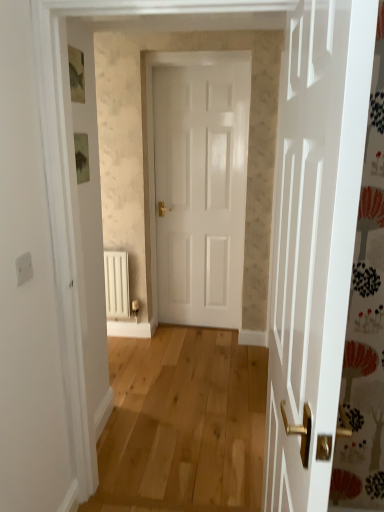
Question: Is the depth of white glossy door at center less than that of white matte radiator at lower left?

Choices:
 (A) no
 (B) yes

Answer: (B)

Question: Is white glossy door at center bigger than white matte radiator at lower left?

Choices:
 (A) yes
 (B) no

Answer: (A)

Question: Is white glossy door at center at the right side of white matte radiator at lower left?

Choices:
 (A) yes
 (B) no

Answer: (A)

Question: From the image's perspective, is white glossy door at center over white matte radiator at lower left?

Choices:
 (A) yes
 (B) no

Answer: (A)

Question: Is white glossy door at center taller than white matte radiator at lower left?

Choices:
 (A) no
 (B) yes

Answer: (B)

Question: Considering the relative sizes of white glossy door at center and white matte radiator at lower left in the image provided, is white glossy door at center wider than white matte radiator at lower left?

Choices:
 (A) yes
 (B) no

Answer: (B)

Question: Is white glossy door at center a part of white matte radiator at lower left?

Choices:
 (A) no
 (B) yes

Answer: (A)

Question: Considering the relative sizes of white matte radiator at lower left and white glossy door at center in the image provided, is white matte radiator at lower left bigger than white glossy door at center?

Choices:
 (A) no
 (B) yes

Answer: (A)

Question: Is white matte radiator at lower left positioned far away from white glossy door at center?

Choices:
 (A) no
 (B) yes

Answer: (A)

Question: From the image's perspective, is white matte radiator at lower left above white glossy door at center?

Choices:
 (A) yes
 (B) no

Answer: (B)

Question: Is the position of white matte radiator at lower left more distant than that of white glossy door at center?

Choices:
 (A) yes
 (B) no

Answer: (A)

Question: Does white matte radiator at lower left have a greater width compared to white glossy door at center?

Choices:
 (A) no
 (B) yes

Answer: (B)

Question: From a real-world perspective, is white glossy door at center positioned above or below white matte radiator at lower left?

Choices:
 (A) above
 (B) below

Answer: (A)